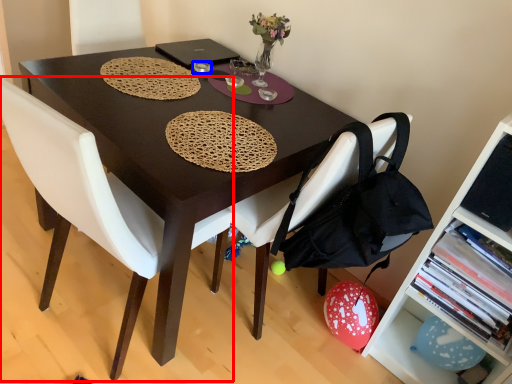
Question: Which of the following is the closest to the observer, chair (highlighted by a red box) or tableware (highlighted by a blue box)?

Choices:
 (A) chair
 (B) tableware

Answer: (A)